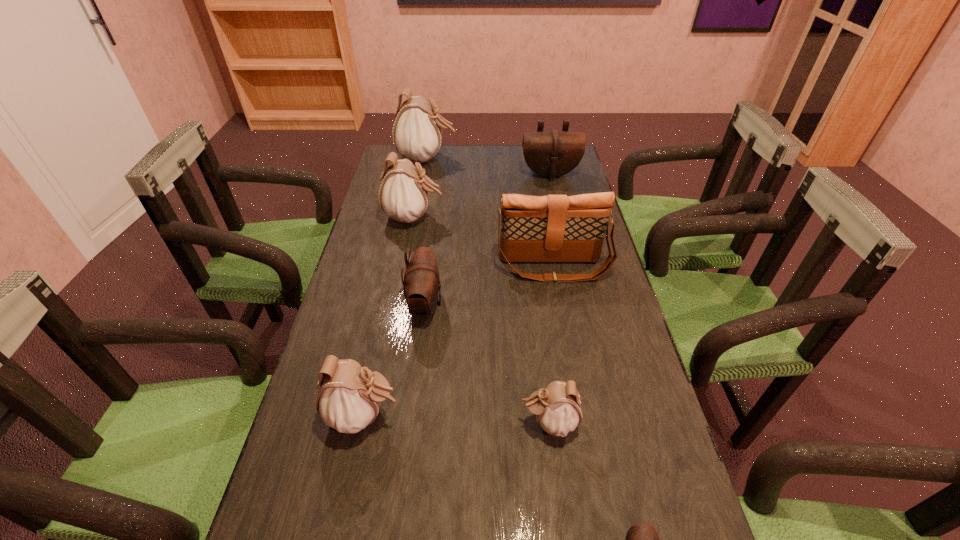
Locate an element on the screen. This screenshot has height=540, width=960. blank area located 0.050m on the front-facing side of the tallest pouch is located at coordinates (469, 158).

Where is `free region located on the front-facing side of the shoulder bag`? The width and height of the screenshot is (960, 540). free region located on the front-facing side of the shoulder bag is located at coordinates (569, 357).

You are a GUI agent. You are given a task and a screenshot of the screen. Output one action in this format:
    pyautogui.click(x=<x>, y=<y>)
    Task: Click on the vacant point located on the front-facing side of the third farthest object
    Image resolution: width=960 pixels, height=540 pixels.
    Given the screenshot: What is the action you would take?
    pyautogui.click(x=516, y=218)

This screenshot has width=960, height=540. Identify the location of free region located with the flap open on the biggest brown pouch. (562, 225).

At what (x,y) coordinates should I click in order to perform the action: click on vacant space situated on the front-facing side of the third biggest white pouch. Please return your answer as a coordinate pair (x, y). The width and height of the screenshot is (960, 540). Looking at the image, I should click on (504, 415).

Where is `vacant area situated with the flap open on the leftmost brown pouch`? The width and height of the screenshot is (960, 540). vacant area situated with the flap open on the leftmost brown pouch is located at coordinates coord(502,304).

Image resolution: width=960 pixels, height=540 pixels. In order to click on free spot located on the front-facing side of the rightmost white pouch in this screenshot , I will do `click(375, 422)`.

You are a GUI agent. You are given a task and a screenshot of the screen. Output one action in this format:
    pyautogui.click(x=<x>, y=<y>)
    Task: Click on the vacant area located on the front-facing side of the rightmost white pouch
    This screenshot has height=540, width=960.
    Given the screenshot: What is the action you would take?
    pyautogui.click(x=488, y=422)

The image size is (960, 540). I want to click on blank space located 0.340m on the front-facing side of the rightmost white pouch, so click(x=361, y=422).

Find the location of `shoulder bag that is positioned at the right edge`. shoulder bag that is positioned at the right edge is located at coordinates (554, 228).